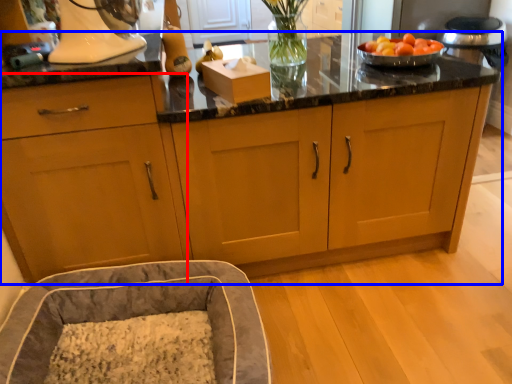
Question: Which point is further to the camera, cabinetry (highlighted by a red box) or cabinetry (highlighted by a blue box)?

Choices:
 (A) cabinetry
 (B) cabinetry

Answer: (B)